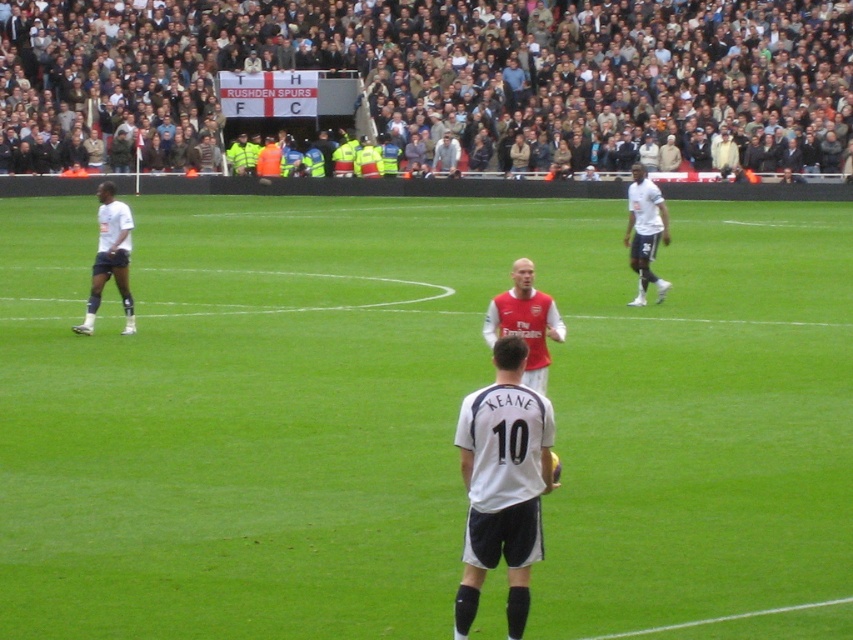
You are a photographer standing at the edge of the soccer field. You want to take a photo that includes both the point at coordinates point (71, 22) and point (83, 321). Which point should you focus on first to ensure both are in sharp focus?

You should focus on point (71, 22) first because it is closer to the camera than point (83, 321). By focusing on the closer point, the farther point will also be within the depth of field, ensuring both are in sharp focus.

You are a photographer standing at the edge of the soccer field. You want to take a photo of the point at coordinates (531, 298). The soccer field is 100 meters long. Is the point within the field length?

The point at coordinates (531, 298) is 11.26 meters away from the viewer. Since the soccer field is 100 meters long, the point is within the field length.